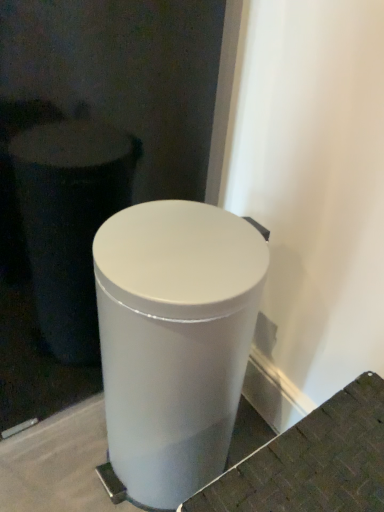
Question: Is white glossy trash can at center not inside white matte trash can at center?

Choices:
 (A) yes
 (B) no

Answer: (A)

Question: Does white glossy trash can at center have a lesser height compared to white matte trash can at center?

Choices:
 (A) no
 (B) yes

Answer: (A)

Question: Is white glossy trash can at center closer to camera compared to white matte trash can at center?

Choices:
 (A) yes
 (B) no

Answer: (B)

Question: Can you confirm if white glossy trash can at center is positioned to the left of white matte trash can at center?

Choices:
 (A) no
 (B) yes

Answer: (B)

Question: Is white glossy trash can at center thinner than white matte trash can at center?

Choices:
 (A) no
 (B) yes

Answer: (B)

Question: Is white matte trash can at center inside white glossy trash can at center?

Choices:
 (A) yes
 (B) no

Answer: (B)

Question: Is white matte trash can at center at the left side of white glossy trash can at center?

Choices:
 (A) no
 (B) yes

Answer: (A)

Question: Could you tell me if white matte trash can at center is turned towards white glossy trash can at center?

Choices:
 (A) no
 (B) yes

Answer: (A)

Question: Is white matte trash can at center not inside white glossy trash can at center?

Choices:
 (A) yes
 (B) no

Answer: (A)

Question: Is white matte trash can at center oriented away from white glossy trash can at center?

Choices:
 (A) yes
 (B) no

Answer: (B)

Question: Can you confirm if white matte trash can at center is shorter than white glossy trash can at center?

Choices:
 (A) yes
 (B) no

Answer: (A)

Question: Is white matte trash can at center thinner than white glossy trash can at center?

Choices:
 (A) yes
 (B) no

Answer: (B)

Question: From the image's perspective, relative to white matte trash can at center, is white glossy trash can at center above or below?

Choices:
 (A) above
 (B) below

Answer: (A)